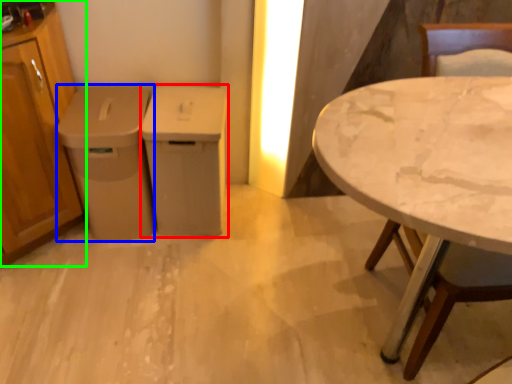
Question: Based on their relative distances, which object is nearer to cabinetry (highlighted by a red box)? Choose from cabinetry (highlighted by a blue box) and cabinetry (highlighted by a green box).

Choices:
 (A) cabinetry
 (B) cabinetry

Answer: (A)